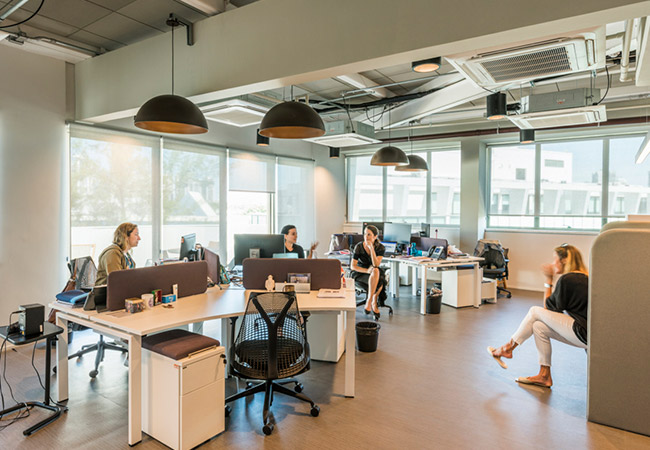
At what (x,y) coordinates should I click in order to perform the action: click on electric light sources. Please return your answer as a coordinate pair (x, y). The width and height of the screenshot is (650, 450). Looking at the image, I should click on (161, 106), (280, 115), (380, 144), (413, 159), (429, 69), (497, 101), (533, 137), (333, 153), (259, 146).